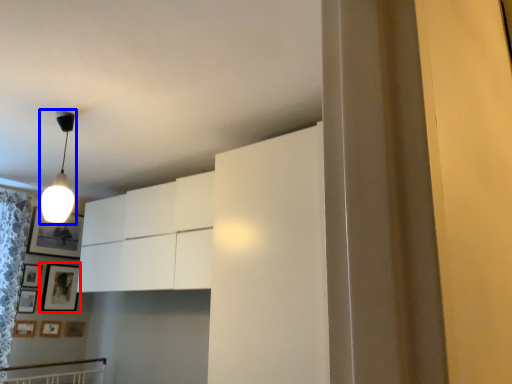
Question: Which object is closer to the camera taking this photo, picture frame (highlighted by a red box) or lamp (highlighted by a blue box)?

Choices:
 (A) picture frame
 (B) lamp

Answer: (B)